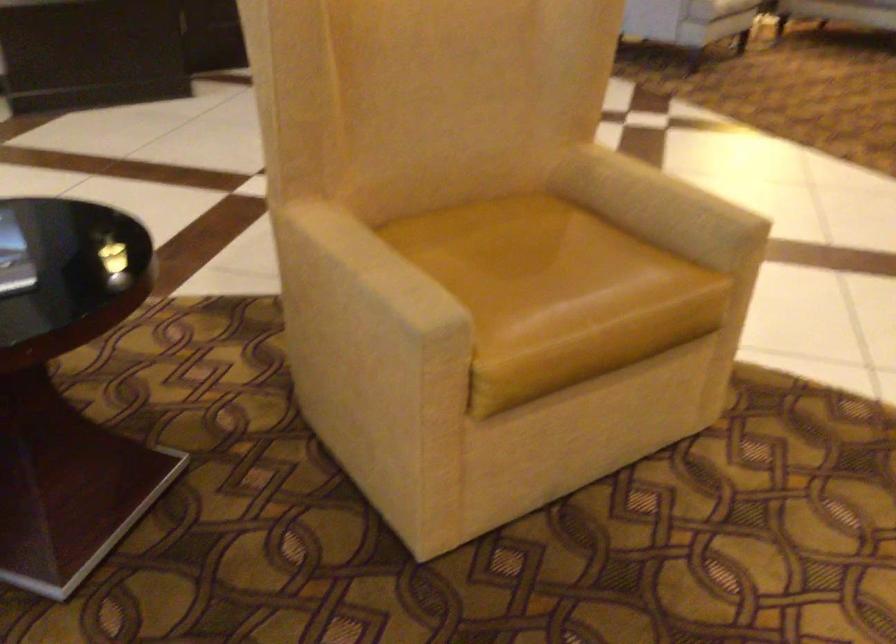
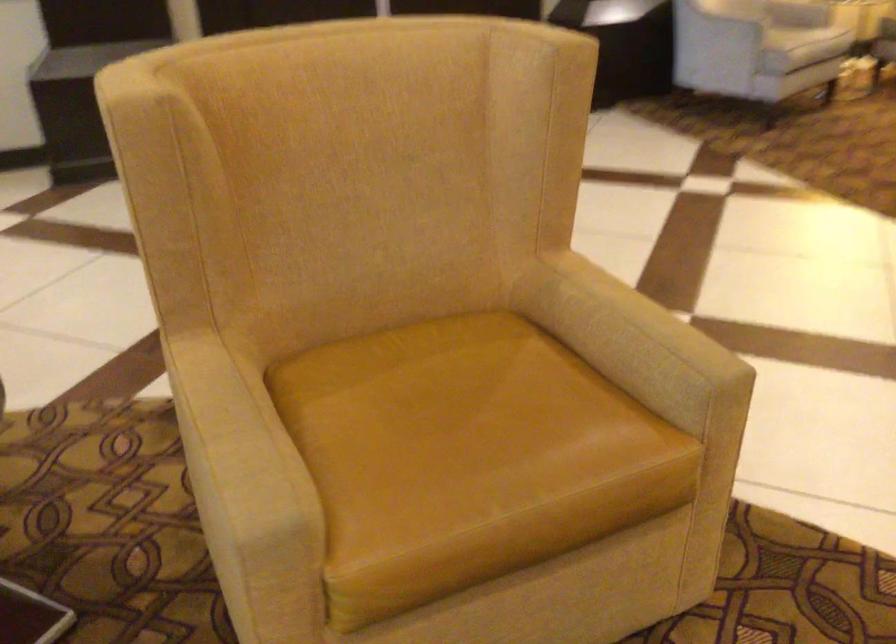
Question: Based on the continuous images, in which direction is the camera rotating? Reply with the corresponding letter.

Choices:
 (A) Left
 (B) Right
 (C) Up
 (D) Down

Answer: (A)